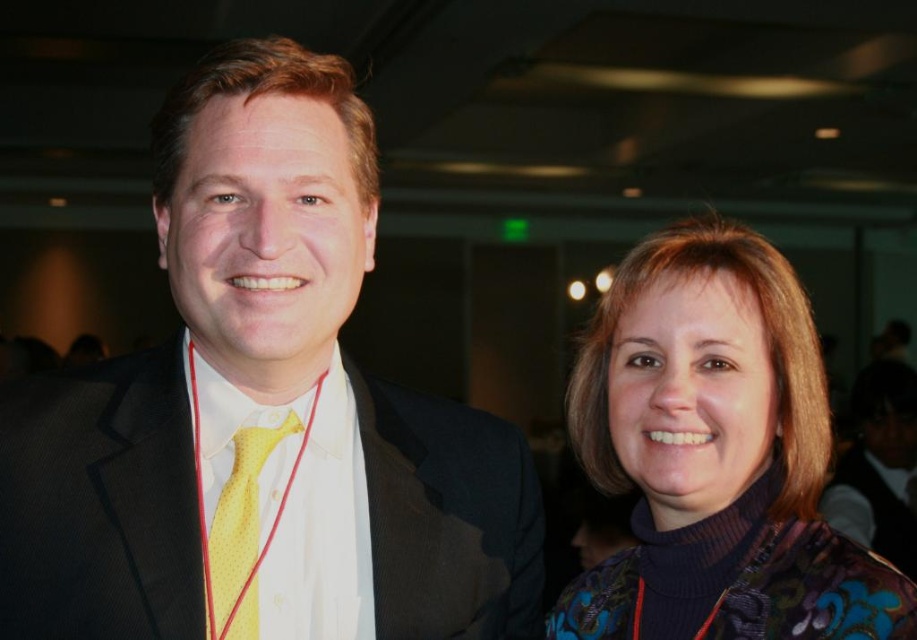
Question: Which point is closer to the camera?

Choices:
 (A) 412,509
 (B) 826,416

Answer: (A)

Question: Where is matte black suit at left located in relation to yellow dotted tie at center in the image?

Choices:
 (A) below
 (B) above

Answer: (B)

Question: Is matte black suit at left above yellow dotted tie at center?

Choices:
 (A) no
 (B) yes

Answer: (B)

Question: Which object is the closest to the matte black suit at left?

Choices:
 (A) yellow dotted tie at center
 (B) multicolored floral sweater at right

Answer: (A)

Question: Which point appears farthest from the camera in this image?

Choices:
 (A) (609, 483)
 (B) (160, 419)
 (C) (290, 412)

Answer: (A)

Question: Where is matte black suit at left located in relation to yellow dotted tie at center in the image?

Choices:
 (A) left
 (B) right

Answer: (B)